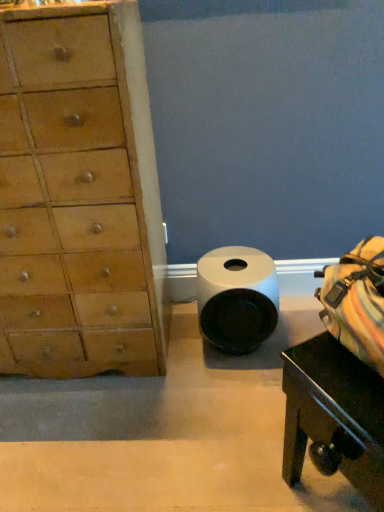
Find the location of a particular element. This screenshot has width=384, height=512. free space in front of white matte toilet paper at center is located at coordinates [228, 395].